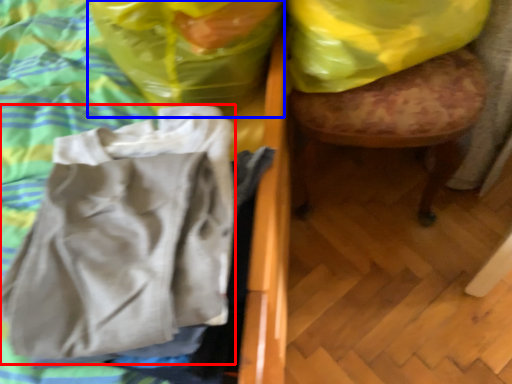
Question: Among these objects, which one is farthest to the camera, wrap (highlighted by a red box) or plastic bag (highlighted by a blue box)?

Choices:
 (A) wrap
 (B) plastic bag

Answer: (B)